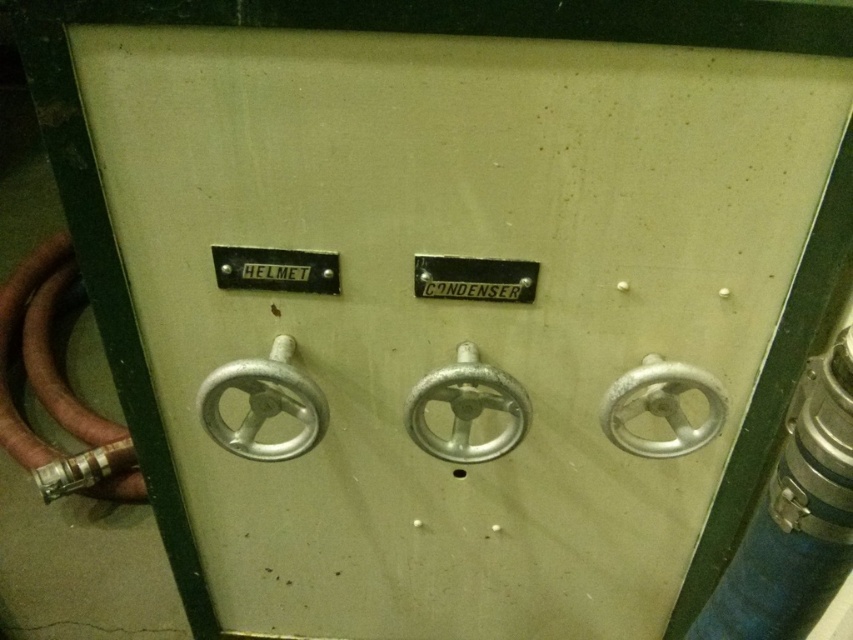
What do you see at coordinates (795, 516) in the screenshot?
I see `silver metallic pipe at right` at bounding box center [795, 516].

Which is in front, point (784, 477) or point (268, 284)?

Point (784, 477)

Identify the location of silver metallic pipe at right. (795, 516).

The image size is (853, 640). Identify the location of silver metallic pipe at right. (795, 516).

Can you confirm if brown rubber hose at left is positioned to the left of metallic silver valve at right?

Indeed, brown rubber hose at left is positioned on the left side of metallic silver valve at right.

Between brown rubber hose at left and metallic silver valve at right, which one has less height?

Standing shorter between the two is metallic silver valve at right.

Consider the image. Who is more forward, (9, 285) or (653, 380)?

Positioned in front is point (653, 380).

I want to click on brown rubber hose at left, so click(x=41, y=356).

Is brown rubber hose at left above matte metal helmet at upper left?

No.

Between brown rubber hose at left and matte metal helmet at upper left, which one has more height?

Standing taller between the two is brown rubber hose at left.

Which is behind, point (18, 273) or point (276, 260)?

The point (18, 273) is behind.

Where is `brown rubber hose at left`? The width and height of the screenshot is (853, 640). brown rubber hose at left is located at coordinates (41, 356).